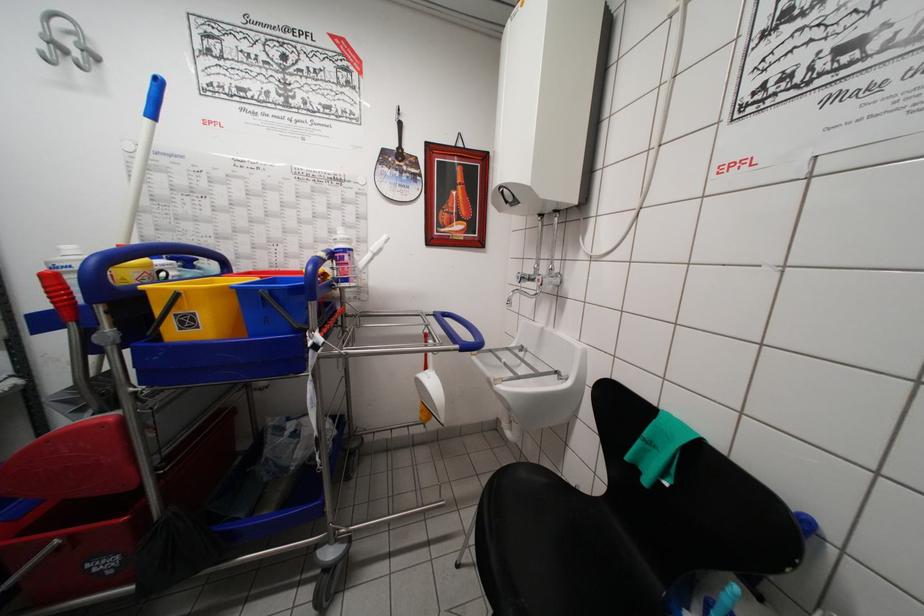
This screenshot has width=924, height=616. Describe the element at coordinates (315, 275) in the screenshot. I see `a blue bucket handle` at that location.